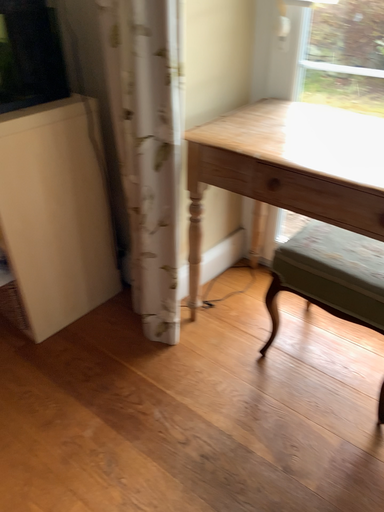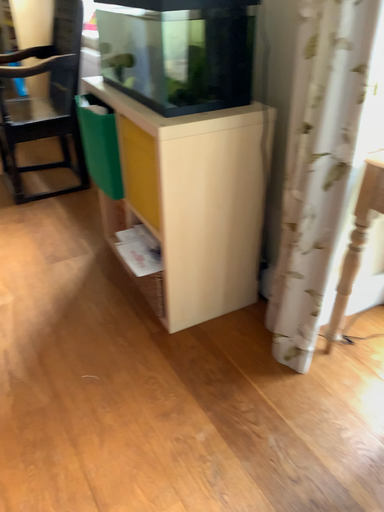
Question: Which way did the camera rotate in the video?

Choices:
 (A) rotated left
 (B) rotated right

Answer: (A)